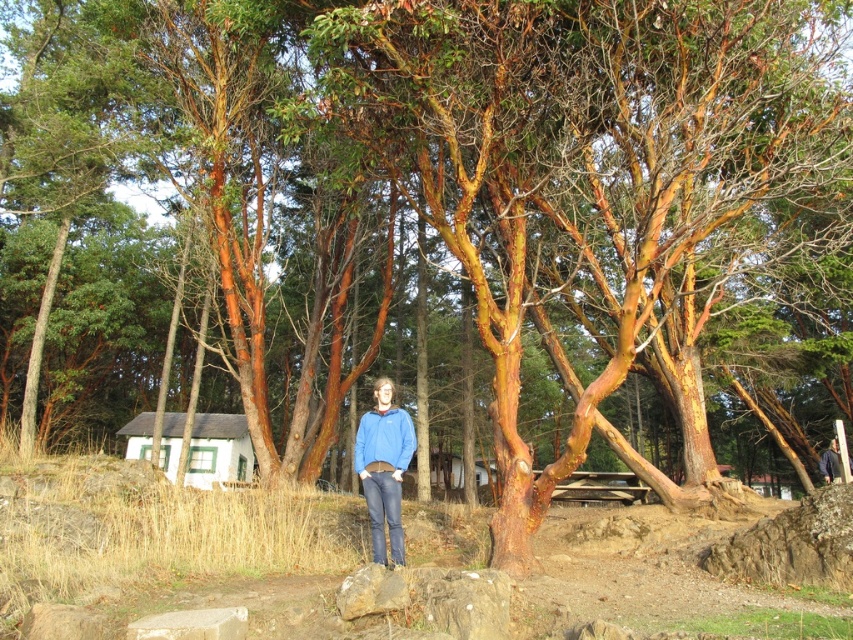
Between smooth gray rock at lower center and brown rough rock at center, which one has less height?

smooth gray rock at lower center

Is point (508, 598) positioned after point (344, 588)?

That is True.

What are the coordinates of `smooth gray rock at lower center` in the screenshot? It's located at (467, 602).

Which is below, blue fleece jacket at center or brown rough rock at center?

Positioned lower is brown rough rock at center.

Which is behind, point (375, 481) or point (396, 580)?

The point (375, 481) is more distant.

This screenshot has width=853, height=640. What do you see at coordinates (384, 467) in the screenshot? I see `blue fleece jacket at center` at bounding box center [384, 467].

What are the coordinates of `blue fleece jacket at center` in the screenshot? It's located at (384, 467).

Between blue fleece jacket at center and blue fabric jacket at center, which one is positioned higher?

blue fleece jacket at center is higher up.

Does blue fleece jacket at center appear over blue fabric jacket at center?

Correct, blue fleece jacket at center is located above blue fabric jacket at center.

At what (x,y) coordinates should I click in order to perform the action: click on blue fleece jacket at center. Please return your answer as a coordinate pair (x, y). The height and width of the screenshot is (640, 853). Looking at the image, I should click on (384, 467).